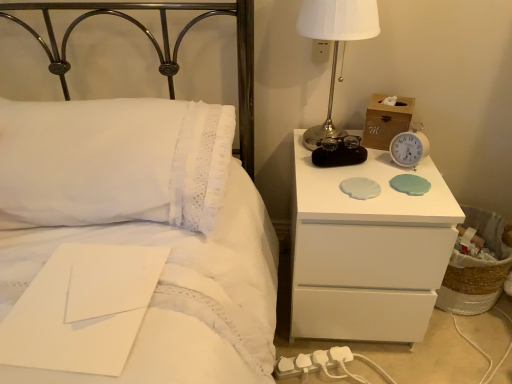
Locate an element on the screen. unoccupied region to the right of white plastic alarm clock at upper right, marked as the first alarm clock in a left-to-right arrangement is located at coordinates (394, 175).